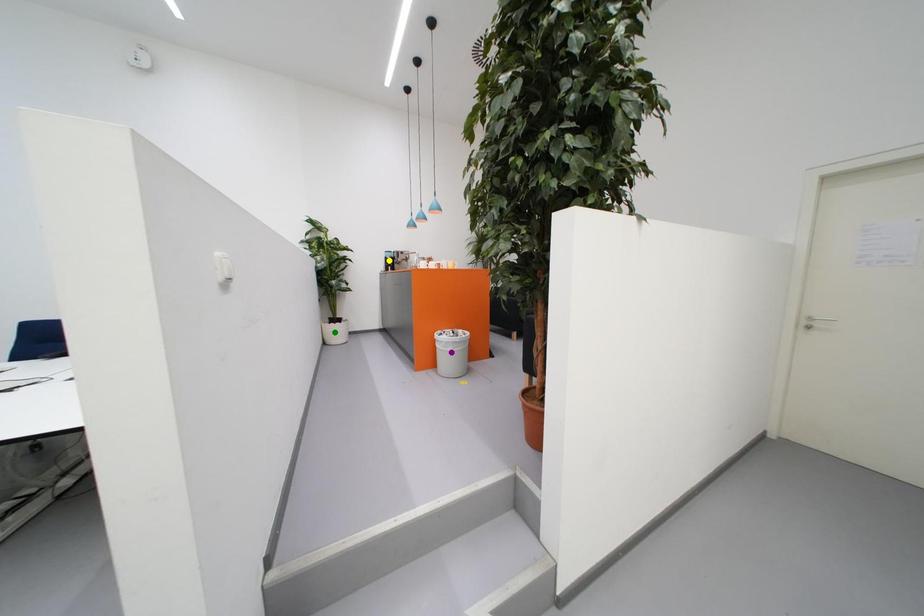
From the picture: Order these from nearest to farthest:
A) purple point
B) yellow point
C) green point

purple point
green point
yellow point